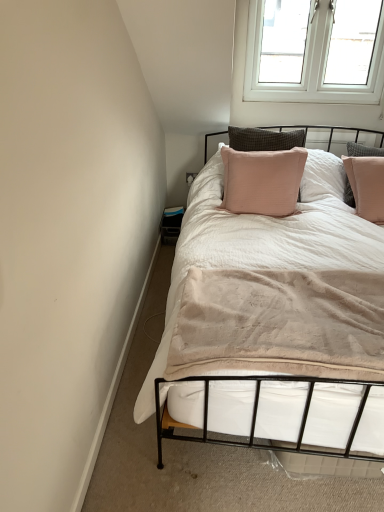
Question: From the image's perspective, would you say white plastic window at upper right is positioned over pink fabric pillow at upper center?

Choices:
 (A) no
 (B) yes

Answer: (B)

Question: From the image's perspective, is white plastic window at upper right under pink fabric pillow at upper center?

Choices:
 (A) no
 (B) yes

Answer: (A)

Question: Is white plastic window at upper right facing towards pink fabric pillow at upper center?

Choices:
 (A) no
 (B) yes

Answer: (A)

Question: Considering the relative positions of white plastic window at upper right and pink fabric pillow at upper center in the image provided, is white plastic window at upper right to the left of pink fabric pillow at upper center from the viewer's perspective?

Choices:
 (A) no
 (B) yes

Answer: (A)

Question: Considering the relative sizes of white plastic window at upper right and pink fabric pillow at upper center in the image provided, is white plastic window at upper right thinner than pink fabric pillow at upper center?

Choices:
 (A) no
 (B) yes

Answer: (B)

Question: From a real-world perspective, is white plastic window at upper right positioned under pink fabric pillow at upper center based on gravity?

Choices:
 (A) yes
 (B) no

Answer: (B)

Question: Is white soft bed at center taller than white plastic window at upper right?

Choices:
 (A) no
 (B) yes

Answer: (A)

Question: From the image's perspective, is white soft bed at center above white plastic window at upper right?

Choices:
 (A) no
 (B) yes

Answer: (A)

Question: From the image's perspective, would you say white soft bed at center is shown under white plastic window at upper right?

Choices:
 (A) no
 (B) yes

Answer: (B)

Question: Is white soft bed at center oriented away from white plastic window at upper right?

Choices:
 (A) no
 (B) yes

Answer: (A)

Question: Does white soft bed at center have a lesser width compared to white plastic window at upper right?

Choices:
 (A) yes
 (B) no

Answer: (B)

Question: Considering the relative sizes of white soft bed at center and white plastic window at upper right in the image provided, is white soft bed at center shorter than white plastic window at upper right?

Choices:
 (A) yes
 (B) no

Answer: (A)

Question: Is pink fabric pillow at upper center bigger than white soft bed at center?

Choices:
 (A) yes
 (B) no

Answer: (B)